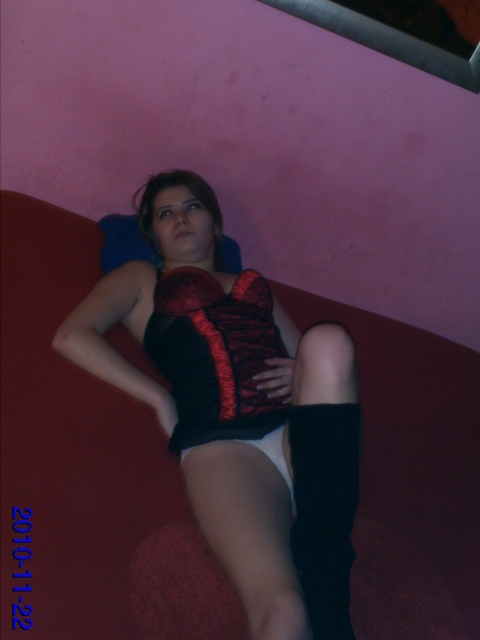
Who is lower down, black satin corset at center or black lace corset at center?

Positioned lower is black satin corset at center.

Which of these two, black satin corset at center or black lace corset at center, stands shorter?

black lace corset at center is shorter.

Who is more forward, (330, 384) or (182, 420)?

Point (330, 384) is more forward.

At what (x,y) coordinates should I click in order to perform the action: click on black satin corset at center. Please return your answer as a coordinate pair (x, y). This screenshot has height=640, width=480. Looking at the image, I should click on (238, 410).

Is point (202, 312) closer to viewer compared to point (294, 515)?

No, (202, 312) is behind (294, 515).

Which is above, black satin corset at center or white matte underwear at lower center?

Positioned higher is black satin corset at center.

The height and width of the screenshot is (640, 480). I want to click on black satin corset at center, so click(238, 410).

Where is `black satin corset at center`? The image size is (480, 640). black satin corset at center is located at coordinates (238, 410).

Is black lace corset at center further to the viewer compared to white matte underwear at lower center?

Yes, black lace corset at center is further from the viewer.

Measure the distance from black lace corset at center to white matte underwear at lower center.

black lace corset at center is 7.98 inches from white matte underwear at lower center.

Locate an element on the screen. This screenshot has width=480, height=640. black lace corset at center is located at coordinates (215, 355).